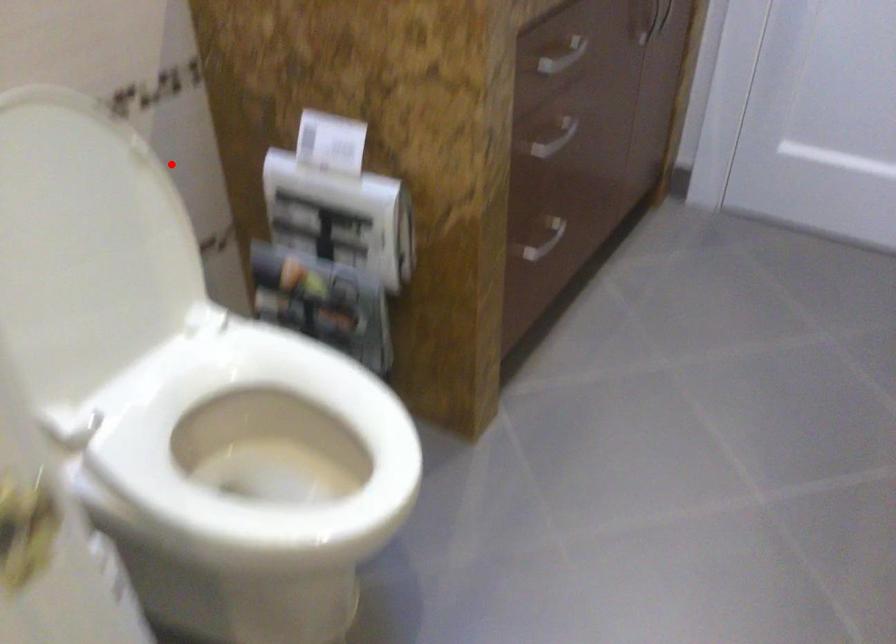
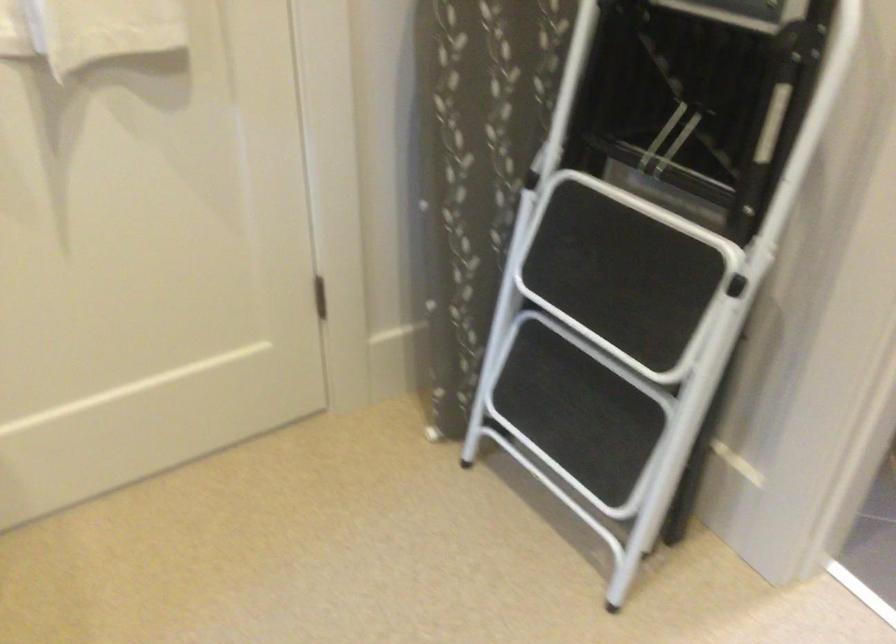
Question: I am providing you with two images of the same scene from different viewpoints. A red point is marked on the first image. Is the red point's position out of view in image 2?

Choices:
 (A) Yes
 (B) No

Answer: (A)